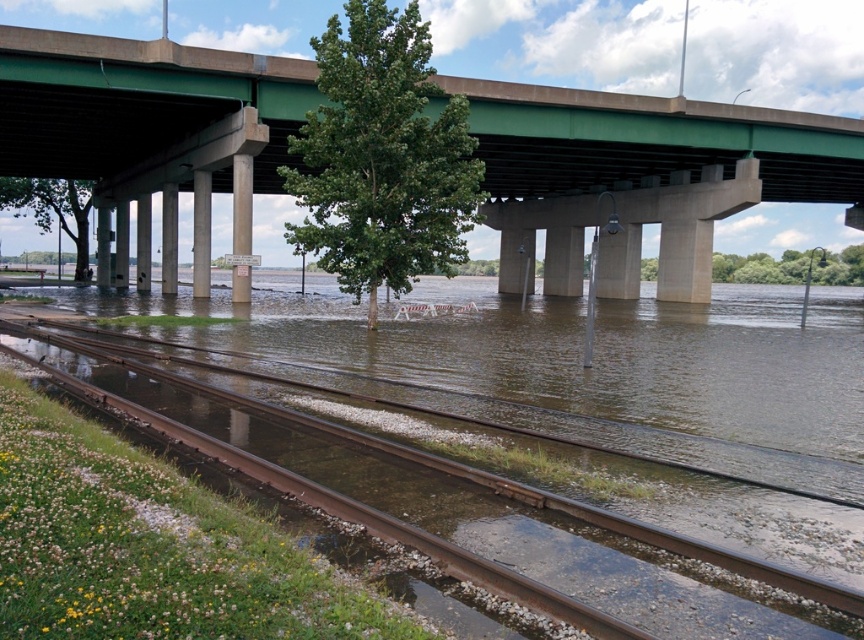
You are a construction worker assessing the flooded area under the bridge. You see the concrete signpost at center and the concrete at center. Which object is taller?

The concrete signpost at center is taller than the concrete at center.

You are a delivery drone flying at an altitude of 20 meters. You need to pass under the green concrete bridge at upper center to reach your destination. Is there enough clearance for you to safely pass underneath without hitting the bridge?

The green concrete bridge at upper center is 24.15 meters from the camera. Since the drone is flying at 20 meters altitude, there is sufficient clearance for it to safely pass underneath the green concrete bridge at upper center.